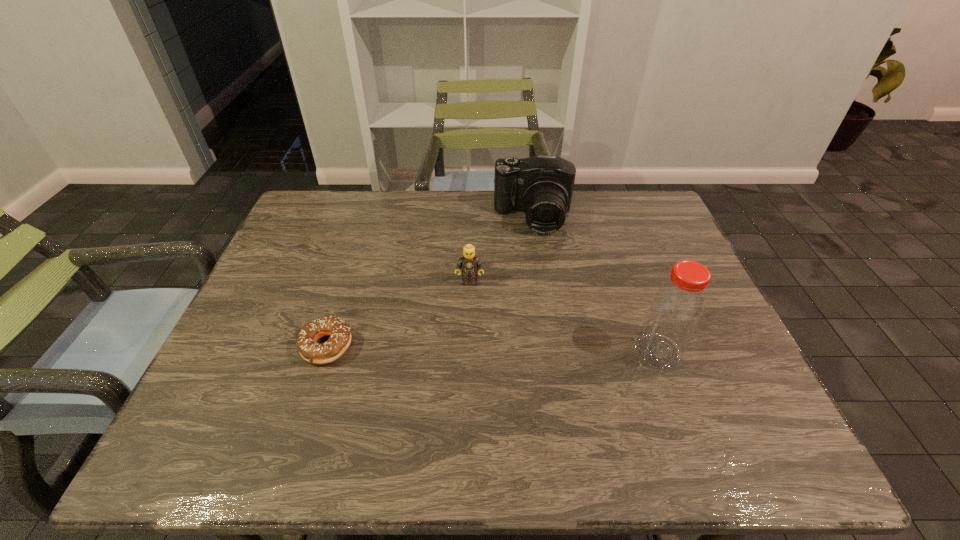
In order to click on blank region between the second shortest object and the doughnut in this screenshot , I will do `click(398, 314)`.

This screenshot has width=960, height=540. I want to click on vacant space that's between the leftmost object and the third object from right to left, so click(398, 314).

In order to click on empty location between the leftmost object and the farthest object in this screenshot , I will do `click(430, 282)`.

Identify the location of vacant point located between the third shortest object and the bottle. The height and width of the screenshot is (540, 960). (595, 285).

This screenshot has height=540, width=960. Find the location of `the closest object relative to the third tallest object`. the closest object relative to the third tallest object is located at coordinates (541, 186).

Locate an element on the screen. object that stands as the closest to the rightmost object is located at coordinates pos(541,186).

The image size is (960, 540). Identify the location of free space that satisfies the following two spatial constraints: 1. on the front side of the third shortest object; 2. on the right side of the rightmost object. (553, 352).

This screenshot has height=540, width=960. Find the location of `vacant region that satisfies the following two spatial constraints: 1. on the front side of the tallest object; 2. on the left side of the doughnut`. vacant region that satisfies the following two spatial constraints: 1. on the front side of the tallest object; 2. on the left side of the doughnut is located at coordinates (325, 352).

The image size is (960, 540). I want to click on free location that satisfies the following two spatial constraints: 1. on the front side of the shortest object; 2. on the right side of the rightmost object, so point(325,352).

What are the coordinates of `blank area in the image that satisfies the following two spatial constraints: 1. on the front side of the leftmost object; 2. on the left side of the bottle` in the screenshot? It's located at tap(325, 352).